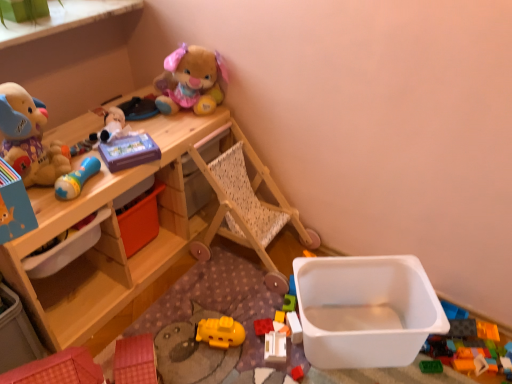
This screenshot has width=512, height=384. I want to click on free space in front of translucent plastic blocks at center, the 3th toy when ordered from bottom to top, so click(296, 367).